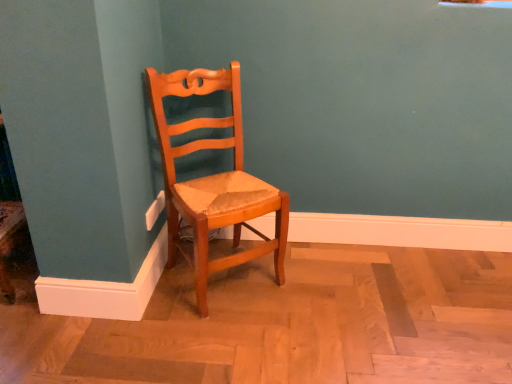
Where is `free region under wooden chair at center (from a real-world perspective)`? free region under wooden chair at center (from a real-world perspective) is located at coordinates (224, 279).